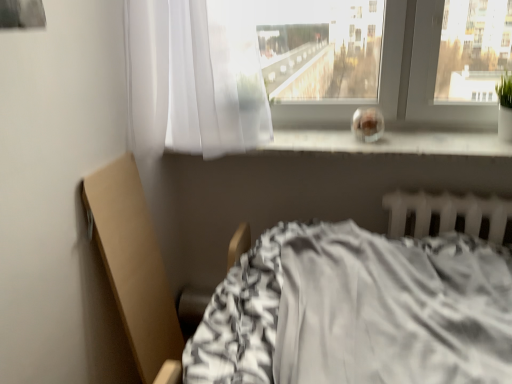
Question: Is sheer white curtain at upper center looking in the opposite direction of gray fabric bed at lower center?

Choices:
 (A) yes
 (B) no

Answer: (B)

Question: Is sheer white curtain at upper center behind gray fabric bed at lower center?

Choices:
 (A) no
 (B) yes

Answer: (B)

Question: Is sheer white curtain at upper center facing towards gray fabric bed at lower center?

Choices:
 (A) yes
 (B) no

Answer: (B)

Question: Is sheer white curtain at upper center with gray fabric bed at lower center?

Choices:
 (A) yes
 (B) no

Answer: (B)

Question: From a real-world perspective, is sheer white curtain at upper center over gray fabric bed at lower center?

Choices:
 (A) no
 (B) yes

Answer: (B)

Question: Would you say sheer white curtain at upper center is outside gray fabric bed at lower center?

Choices:
 (A) no
 (B) yes

Answer: (B)

Question: Could white plastic radiator at lower right be considered to be inside sheer white curtain at upper center?

Choices:
 (A) no
 (B) yes

Answer: (A)

Question: Is sheer white curtain at upper center outside of white plastic radiator at lower right?

Choices:
 (A) yes
 (B) no

Answer: (A)

Question: From the image's perspective, does sheer white curtain at upper center appear higher than white plastic radiator at lower right?

Choices:
 (A) yes
 (B) no

Answer: (A)

Question: Is sheer white curtain at upper center to the right of white plastic radiator at lower right from the viewer's perspective?

Choices:
 (A) yes
 (B) no

Answer: (B)

Question: Are sheer white curtain at upper center and white plastic radiator at lower right making contact?

Choices:
 (A) yes
 (B) no

Answer: (B)

Question: Considering the relative sizes of sheer white curtain at upper center and white plastic radiator at lower right in the image provided, is sheer white curtain at upper center shorter than white plastic radiator at lower right?

Choices:
 (A) no
 (B) yes

Answer: (A)

Question: Is white plastic radiator at lower right oriented towards transparent glass at center?

Choices:
 (A) no
 (B) yes

Answer: (A)